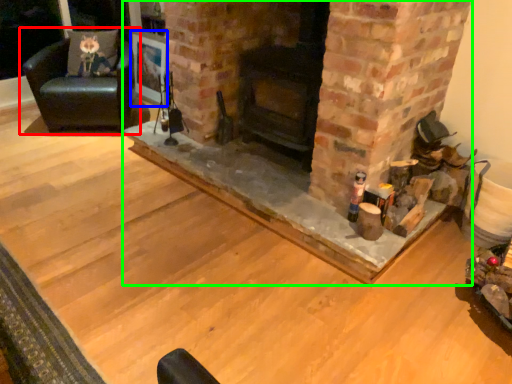
Question: Which object is positioned closest to chair (highlighted by a red box)? Select from picture frame (highlighted by a blue box) and fireplace (highlighted by a green box).

Choices:
 (A) picture frame
 (B) fireplace

Answer: (A)